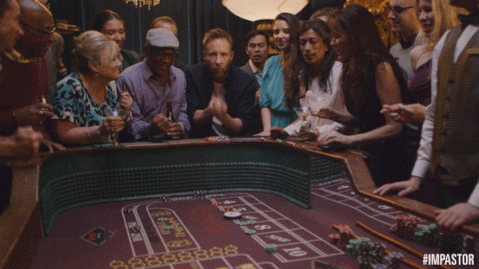
You are a GUI agent. You are given a task and a screenshot of the screen. Output one action in this format:
    pyautogui.click(x=<x>, y=<y>)
    Task: Click on the ground lamp
    Image resolution: width=479 pixels, height=269 pixels.
    Given the screenshot: What is the action you would take?
    pyautogui.click(x=290, y=51)